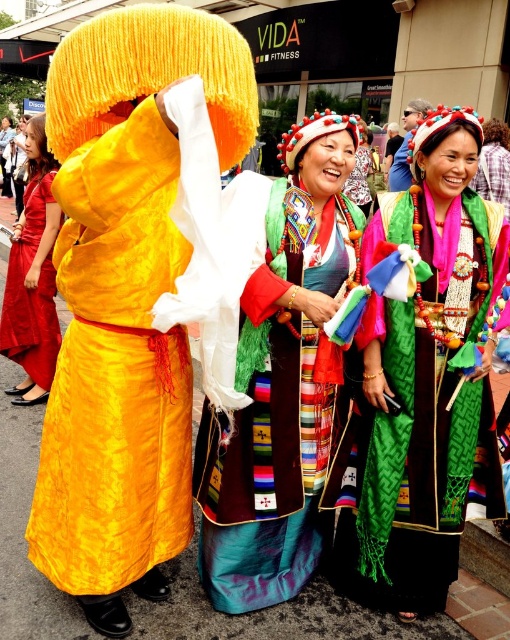
Question: Is velvet yellow costume at left below embroidered silk dress at center?

Choices:
 (A) yes
 (B) no

Answer: (B)

Question: Which is nearer to the matte red dress at left?

Choices:
 (A) embroidered silk dress at center
 (B) velvet yellow costume at left
 (C) green woven scarf at center

Answer: (B)

Question: Which object is closer to the camera taking this photo?

Choices:
 (A) velvet yellow costume at left
 (B) green woven scarf at center
 (C) embroidered silk dress at center

Answer: (A)

Question: From the image, what is the correct spatial relationship of embroidered silk dress at center in relation to matte red dress at left?

Choices:
 (A) below
 (B) above

Answer: (A)

Question: Is velvet yellow costume at left positioned in front of matte red dress at left?

Choices:
 (A) no
 (B) yes

Answer: (B)

Question: Which of the following is the farthest from the observer?

Choices:
 (A) green woven scarf at center
 (B) embroidered silk dress at center
 (C) velvet yellow costume at left
 (D) matte red dress at left

Answer: (D)